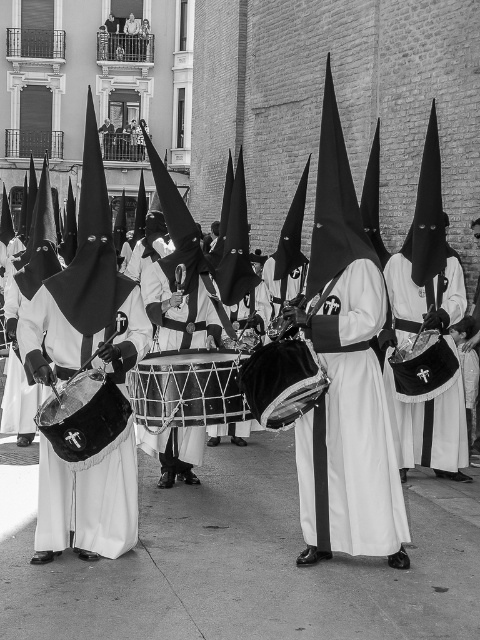
You are a photographer standing in front of the procession. You notice two points marked in the image. The first point is at coordinate point [419,328] and the second is at point [214,372]. Which point is closer to your camera lens?

Point [214,372] is closer to the camera lens because it is less further than point [419,328] according to the description.

You are a photographer standing in the middle of the street, and you want to capture a photo of the velvet black drum at left without including any spectators on the balconies. Is the drum positioned in a way that allows this?

The velvet black drum at left is located at point [86,502], which is on the lower left side of the image. Since the spectators are on the balconies in the background, the drum is positioned low enough to avoid them. Therefore, you can capture the drum without including the spectators.

You are a drummer in the procession and need to choose a drum to carry. You prefer a thinner drum for easier handling. Which drum should you choose between the velvet black drum at left and the velvet drum at center?

The velvet black drum at left is thinner than the velvet drum at center, so you should choose the velvet black drum at left for easier handling.